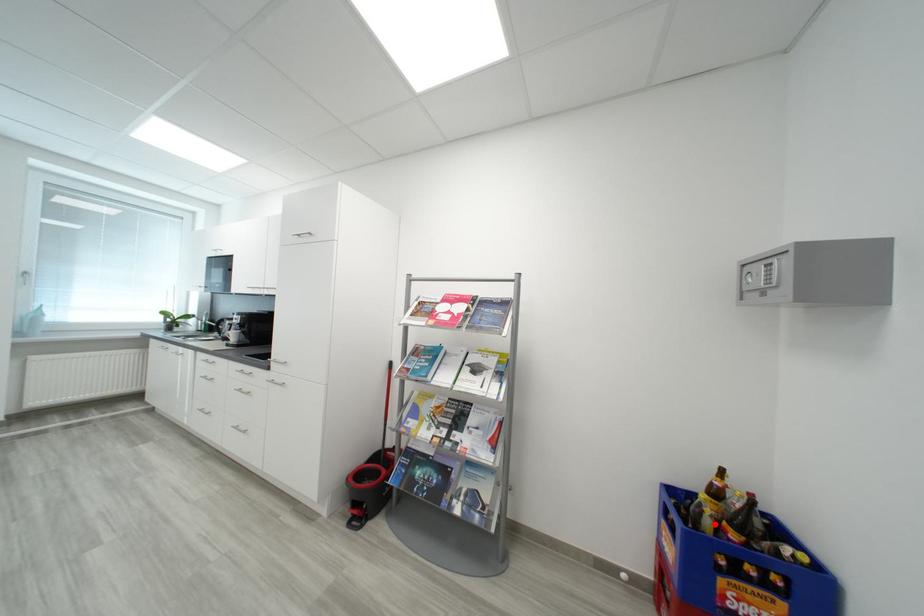
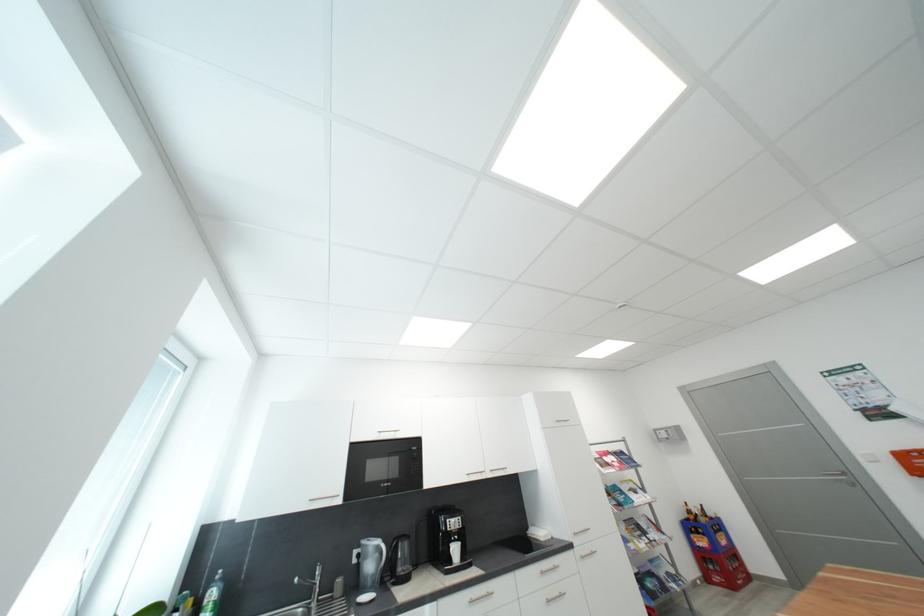
Question: A red point is marked in image1. In image2, is the corresponding 3D point closer to the camera or farther? Reply with the corresponding letter.

Choices:
 (A) The corresponding 3D point is closer.
 (B) The corresponding 3D point is farther.

Answer: (A)